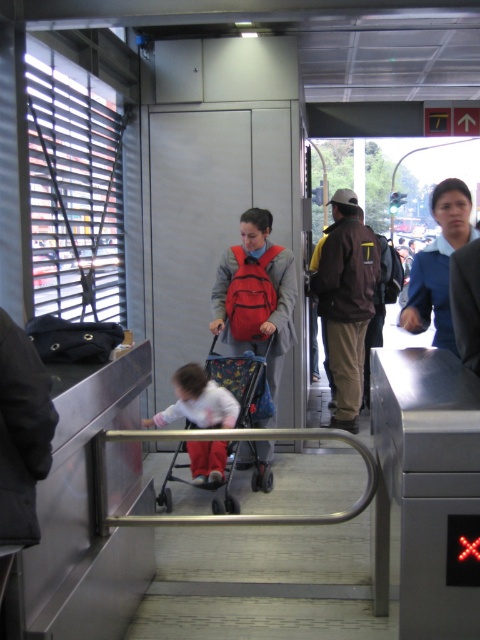
Question: Which object appears closest to the camera in this image?

Choices:
 (A) brown leather jacket at center
 (B) matte red backpack at center

Answer: (B)

Question: Is matte red backpack at center above white cotton shirt at center?

Choices:
 (A) yes
 (B) no

Answer: (A)

Question: Estimate the real-world distances between objects in this image. Which object is farther from the brown leather jacket at center?

Choices:
 (A) white cotton shirt at center
 (B) matte red backpack at center

Answer: (A)

Question: Which object is positioned farthest from the multicolored fabric baby carriage at center?

Choices:
 (A) matte red backpack at center
 (B) brown leather jacket at center

Answer: (B)

Question: Can you confirm if matte red backpack at center is positioned to the right of brown leather jacket at center?

Choices:
 (A) no
 (B) yes

Answer: (A)

Question: Considering the relative positions of matte red backpack at center and white cotton shirt at center in the image provided, where is matte red backpack at center located with respect to white cotton shirt at center?

Choices:
 (A) left
 (B) right

Answer: (B)